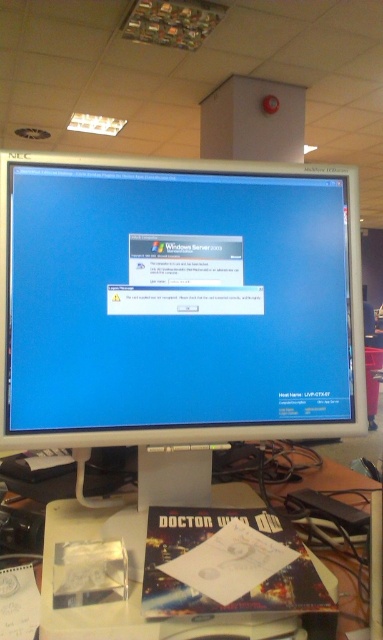
Question: Which object is closer to the camera taking this photo?

Choices:
 (A) white glossy monitor at center
 (B) white plastic computer desk at center

Answer: (A)

Question: Is white glossy monitor at center positioned at the back of white plastic computer desk at center?

Choices:
 (A) yes
 (B) no

Answer: (B)

Question: Is white glossy monitor at center above white plastic computer desk at center?

Choices:
 (A) no
 (B) yes

Answer: (B)

Question: Among these objects, which one is farthest from the camera?

Choices:
 (A) white glossy monitor at center
 (B) white plastic computer desk at center

Answer: (B)

Question: Does white glossy monitor at center appear on the right side of white plastic computer desk at center?

Choices:
 (A) no
 (B) yes

Answer: (A)